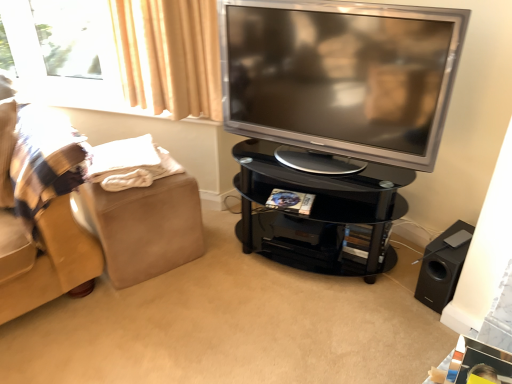
At what (x,y) coordinates should I click in order to perform the action: click on black glass tv stand at center. Please return your answer as a coordinate pair (x, y). This screenshot has width=512, height=384. Looking at the image, I should click on pyautogui.click(x=320, y=215).

Locate an element on the screen. The width and height of the screenshot is (512, 384). black matte speaker at lower right is located at coordinates (443, 266).

Locate an element on the screen. The width and height of the screenshot is (512, 384). black glass tv stand at center is located at coordinates (320, 215).

From the image's perspective, is black glass tv stand at center located above beige fabric footrest at left?

Answer: Yes, from the image's perspective, black glass tv stand at center is above beige fabric footrest at left.

Which point is more forward, (390, 264) or (169, 194)?

The point (169, 194) is closer to the camera.

Between black glass tv stand at center and beige fabric footrest at left, which one is positioned behind?

beige fabric footrest at left is further from the camera.

Is black glass tv stand at center oriented away from beige fabric footrest at left?

No.

Is black glossy tv stand at center turned away from black glass tv stand at center?

black glossy tv stand at center does not have its back to black glass tv stand at center.

From their relative heights in the image, would you say black glossy tv stand at center is taller or shorter than black glass tv stand at center?

In the image, black glossy tv stand at center appears to be shorter than black glass tv stand at center.

Is black glass tv stand at center completely or partially inside black glossy tv stand at center?

That's incorrect, black glass tv stand at center is not inside black glossy tv stand at center.

Can you tell me how much black glossy tv stand at center and black glass tv stand at center differ in facing direction?

The facing directions of black glossy tv stand at center and black glass tv stand at center are 114 degrees apart.

Do you think black glossy tv stand at center is within silver metallic television at upper right, or outside of it?

black glossy tv stand at center is not inside silver metallic television at upper right, it's outside.

Is black glossy tv stand at center positioned before silver metallic television at upper right?

Yes, black glossy tv stand at center is closer to the viewer.

Looking at this image, which of these two, black glossy tv stand at center or silver metallic television at upper right, is wider?

black glossy tv stand at center.

Is silver metallic television at upper right bigger or smaller than black matte speaker at lower right?

Clearly, silver metallic television at upper right is larger in size than black matte speaker at lower right.

Does silver metallic television at upper right appear on the right side of black matte speaker at lower right?

No.

Is black matte speaker at lower right completely or partially inside silver metallic television at upper right?

Actually, black matte speaker at lower right is outside silver metallic television at upper right.

Is point (438, 118) positioned in front of point (443, 302)?

Yes, it is.

In the scene shown: Does beige fabric footrest at left appear on the right side of silver metallic television at upper right?

In fact, beige fabric footrest at left is to the left of silver metallic television at upper right.

Can you confirm if beige fabric footrest at left is thinner than silver metallic television at upper right?

Incorrect, the width of beige fabric footrest at left is not less than that of silver metallic television at upper right.

Can you see beige fabric footrest at left touching silver metallic television at upper right?

No, beige fabric footrest at left is not with silver metallic television at upper right.

Can you tell me how much black glass tv stand at center and black matte speaker at lower right differ in facing direction?

They differ by 24.1 degrees in their facing directions.

Does black glass tv stand at center contain black matte speaker at lower right?

No, black glass tv stand at center does not contain black matte speaker at lower right.

Is black glass tv stand at center aimed at black matte speaker at lower right?

No, black glass tv stand at center is not turned towards black matte speaker at lower right.

How distant is black matte speaker at lower right from black glass tv stand at center?

black matte speaker at lower right is 15.92 inches from black glass tv stand at center.

Can you tell me how much black matte speaker at lower right and black glass tv stand at center differ in facing direction?

The angle between the facing direction of black matte speaker at lower right and the facing direction of black glass tv stand at center is 24.1 degrees.

Is black matte speaker at lower right at the right side of black glass tv stand at center?

Correct, you'll find black matte speaker at lower right to the right of black glass tv stand at center.

Between point (434, 293) and point (314, 267), which one is positioned in front?

The point (434, 293) is closer to the camera.

The image size is (512, 384). I want to click on footrest below the black glass tv stand at center (from a real-world perspective), so click(x=145, y=227).

You are a GUI agent. You are given a task and a screenshot of the screen. Output one action in this format:
    pyautogui.click(x=<x>, y=<y>)
    Task: Click on the plain below the black glass tv stand at center (from the image's perspective)
    The width and height of the screenshot is (512, 384).
    Given the screenshot: What is the action you would take?
    pyautogui.click(x=232, y=326)

Which object lies further to the anchor point black matte speaker at lower right, silver metallic television at upper right or black glossy tv stand at center?

silver metallic television at upper right is positioned further to the anchor black matte speaker at lower right.

Which object lies nearer to the anchor point beige fabric footrest at left, black glass tv stand at center or black matte speaker at lower right?

Based on the image, black glass tv stand at center appears to be nearer to beige fabric footrest at left.

Considering their positions, is black glass tv stand at center positioned further to silver metallic television at upper right than beige fabric footrest at left?

beige fabric footrest at left is further to silver metallic television at upper right.

Based on their spatial positions, is silver metallic television at upper right or black glass tv stand at center closer to beige fabric footrest at left?

black glass tv stand at center.

Considering their positions, is black matte speaker at lower right positioned further to black glass tv stand at center than black glossy tv stand at center?

black matte speaker at lower right lies further to black glass tv stand at center than the other object.

Which object lies further to the anchor point black glossy tv stand at center, silver metallic television at upper right or beige fabric footrest at left?

silver metallic television at upper right lies further to black glossy tv stand at center than the other object.

From the image, which object appears to be nearer to black glossy tv stand at center, black glass tv stand at center or beige fabric footrest at left?

Among the two, beige fabric footrest at left is located nearer to black glossy tv stand at center.

Looking at this image, which object lies further to the anchor point black glass tv stand at center, silver metallic television at upper right or beige fabric footrest at left?

beige fabric footrest at left is further to black glass tv stand at center.

Where is `table located between beige fabric footrest at left and black matte speaker at lower right in the left-right direction`? The image size is (512, 384). table located between beige fabric footrest at left and black matte speaker at lower right in the left-right direction is located at coordinates (320, 215).

Where is `television between beige fabric footrest at left and black glass tv stand at center`? television between beige fabric footrest at left and black glass tv stand at center is located at coordinates (341, 76).

Where is `table positioned between black glossy tv stand at center and beige fabric footrest at left from near to far`? table positioned between black glossy tv stand at center and beige fabric footrest at left from near to far is located at coordinates (320, 215).

I want to click on table situated between black glossy tv stand at center and black matte speaker at lower right from left to right, so click(x=320, y=215).